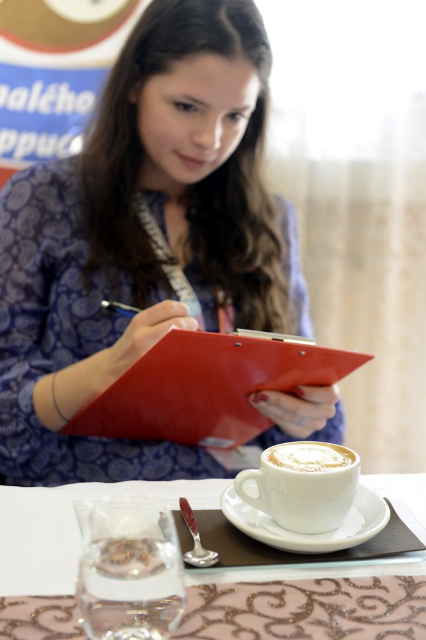
Question: Which point is closer to the camera?

Choices:
 (A) white ceramic cup at center
 (B) white frothy foam at lower center
 (C) red matte clipboard at center
 (D) white ceramic cup at lower center

Answer: (A)

Question: Which object is the farthest from the red matte clipboard at center?

Choices:
 (A) white frothy foam at lower center
 (B) white ceramic saucer at lower center

Answer: (A)

Question: In this image, where is red matte clipboard at center located relative to white frothy foam at lower center?

Choices:
 (A) above
 (B) below

Answer: (B)

Question: Which point is farther to the camera?

Choices:
 (A) (80, 484)
 (B) (282, 492)

Answer: (A)

Question: Does white ceramic cup at center appear under white ceramic saucer at lower center?

Choices:
 (A) yes
 (B) no

Answer: (A)

Question: Does red matte clipboard at center have a smaller size compared to white frothy foam at lower center?

Choices:
 (A) yes
 (B) no

Answer: (B)